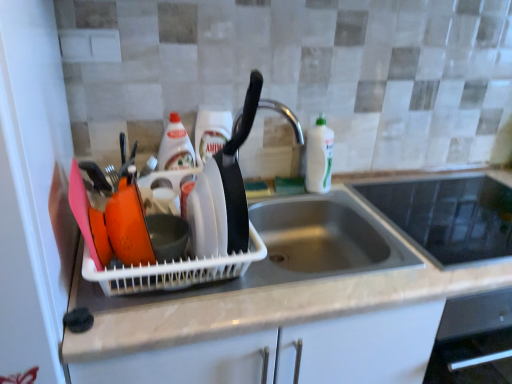
Question: Is white glossy bottle at sink right, the third bottle positioned from the left, shorter than black glass cooktop at upper right?

Choices:
 (A) yes
 (B) no

Answer: (B)

Question: Is black glass cooktop at upper right a part of white glossy bottle at sink right, the third bottle positioned from the left?

Choices:
 (A) no
 (B) yes

Answer: (A)

Question: Is white glossy bottle at sink right, the third bottle positioned from the left, located outside black glass cooktop at upper right?

Choices:
 (A) yes
 (B) no

Answer: (A)

Question: Are white glossy bottle at sink right, the third bottle positioned from the left, and black glass cooktop at upper right beside each other?

Choices:
 (A) no
 (B) yes

Answer: (A)

Question: Is white glossy bottle at sink right, which is the 1th bottle from right to left, closer to the viewer compared to black glass cooktop at upper right?

Choices:
 (A) no
 (B) yes

Answer: (A)

Question: Relative to white glossy bottle at center, marked as the second bottle in a right-to-left arrangement, is translucent plastic bottle at center, marked as the 1th bottle in a left-to-right arrangement, in front or behind?

Choices:
 (A) behind
 (B) front

Answer: (A)

Question: From the image's perspective, is translucent plastic bottle at center, marked as the 1th bottle in a left-to-right arrangement, above or below white glossy bottle at center, the second bottle in the left-to-right sequence?

Choices:
 (A) below
 (B) above

Answer: (A)

Question: Is point (184, 188) closer or farther from the camera than point (196, 153)?

Choices:
 (A) closer
 (B) farther

Answer: (A)

Question: Is translucent plastic bottle at center, positioned as the third bottle in right-to-left order, to the left or to the right of white glossy bottle at center, the second bottle in the left-to-right sequence, in the image?

Choices:
 (A) left
 (B) right

Answer: (A)

Question: Looking at their shapes, would you say white matte countertop at center is wider or thinner than black glass cooktop at upper right?

Choices:
 (A) thin
 (B) wide

Answer: (B)

Question: From the image's perspective, is white matte countertop at center above or below black glass cooktop at upper right?

Choices:
 (A) below
 (B) above

Answer: (A)

Question: From a real-world perspective, is white matte countertop at center above or below black glass cooktop at upper right?

Choices:
 (A) below
 (B) above

Answer: (A)

Question: In the image, is white matte countertop at center on the left side or the right side of black glass cooktop at upper right?

Choices:
 (A) right
 (B) left

Answer: (B)

Question: Is black glass cooktop at upper right in front of or behind translucent plastic bottle at center, marked as the 1th bottle in a left-to-right arrangement, in the image?

Choices:
 (A) front
 (B) behind

Answer: (A)

Question: From a real-world perspective, is black glass cooktop at upper right above or below translucent plastic bottle at center, positioned as the third bottle in right-to-left order?

Choices:
 (A) above
 (B) below

Answer: (B)